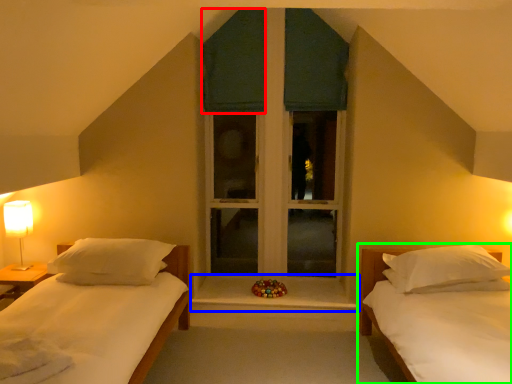
Question: Based on their relative distances, which object is nearer to curtain (highlighted by a red box)? Choose from window sill (highlighted by a blue box) and bed (highlighted by a green box).

Choices:
 (A) window sill
 (B) bed

Answer: (A)